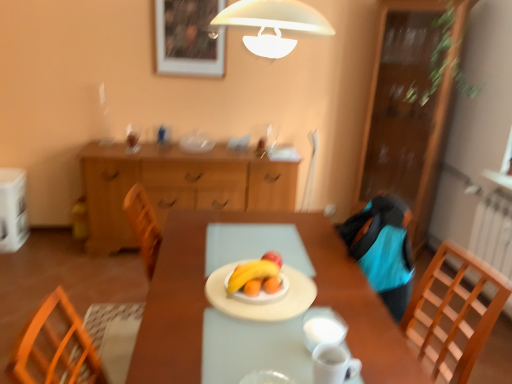
Where is `vacant space behind shiny red apple at center`? This screenshot has width=512, height=384. vacant space behind shiny red apple at center is located at coordinates (281, 245).